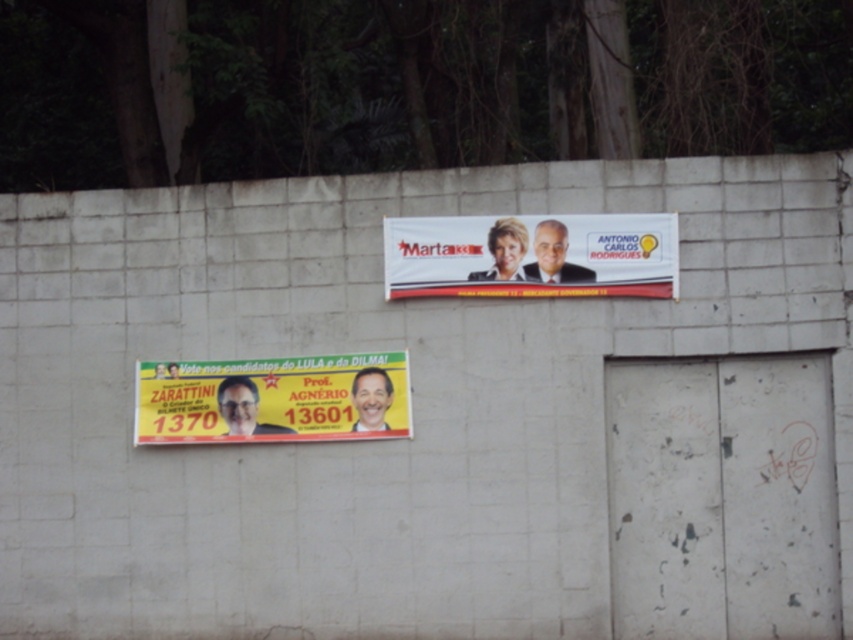
Question: Considering the relative positions of matte black banner at lower center and smooth plastic man at upper center in the image provided, where is matte black banner at lower center located with respect to smooth plastic man at upper center?

Choices:
 (A) below
 (B) above

Answer: (A)

Question: Can you confirm if matte plastic banner at upper center is positioned to the right of matte black man at upper center?

Choices:
 (A) no
 (B) yes

Answer: (A)

Question: Among these points, which one is farthest from the camera?

Choices:
 (A) (358, 401)
 (B) (228, 387)

Answer: (B)

Question: Among these points, which one is farthest from the camera?

Choices:
 (A) (241, 401)
 (B) (149, 364)

Answer: (B)

Question: Which is farther from the matte black banner at lower center?

Choices:
 (A) matte plastic banner at upper center
 (B) smooth yellow face at center
 (C) yellow paper billboard at lower center
 (D) matte black man at upper center

Answer: (D)

Question: Is matte black banner at lower center positioned behind smooth yellow face at center?

Choices:
 (A) yes
 (B) no

Answer: (A)